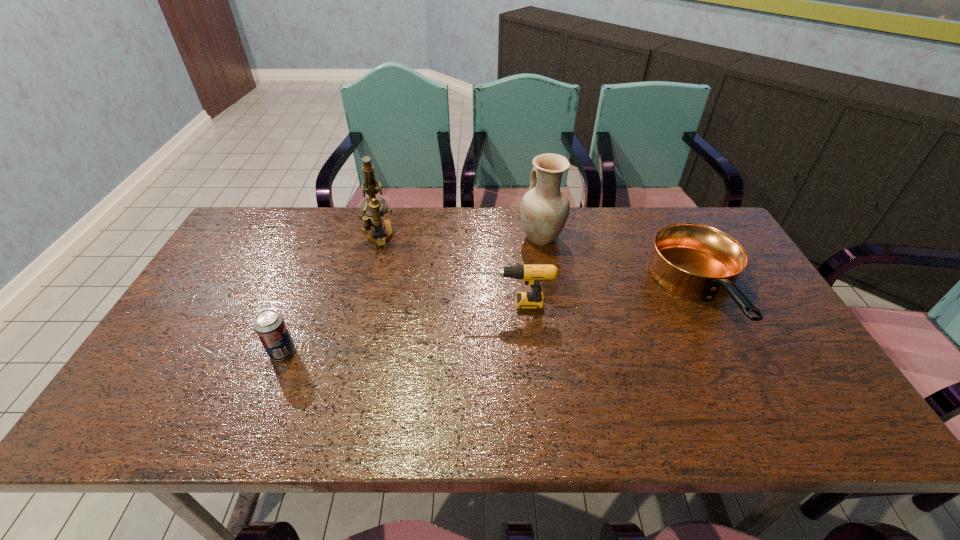
Identify which object is the third closest to the pottery. Please provide its 2D coordinates. Your answer should be formatted as a tuple, i.e. [(x, y)], where the tuple contains the x and y coordinates of a point satisfying the conditions above.

[(373, 208)]

Locate an element on the screen. This screenshot has width=960, height=540. object that can be found as the second closest to the rightmost object is located at coordinates (532, 274).